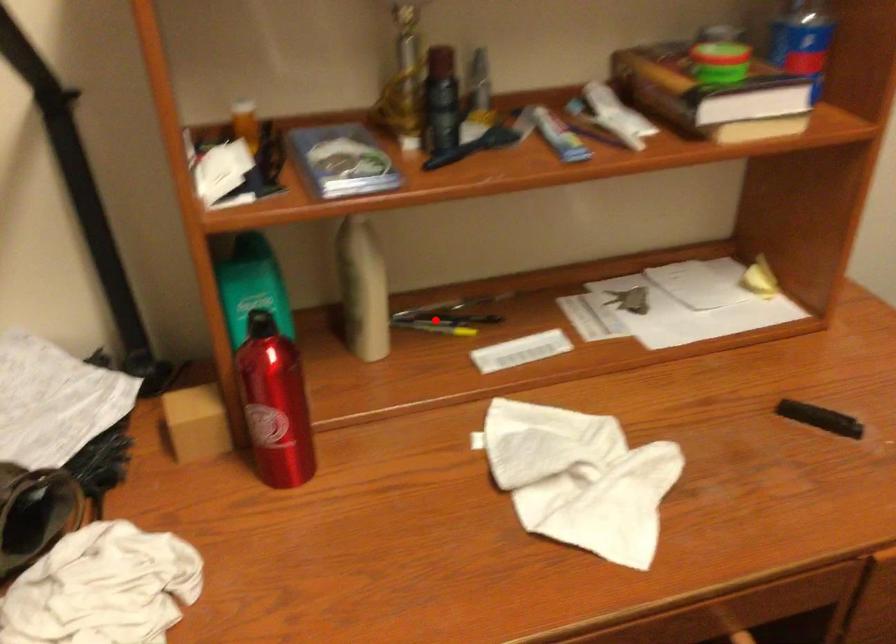
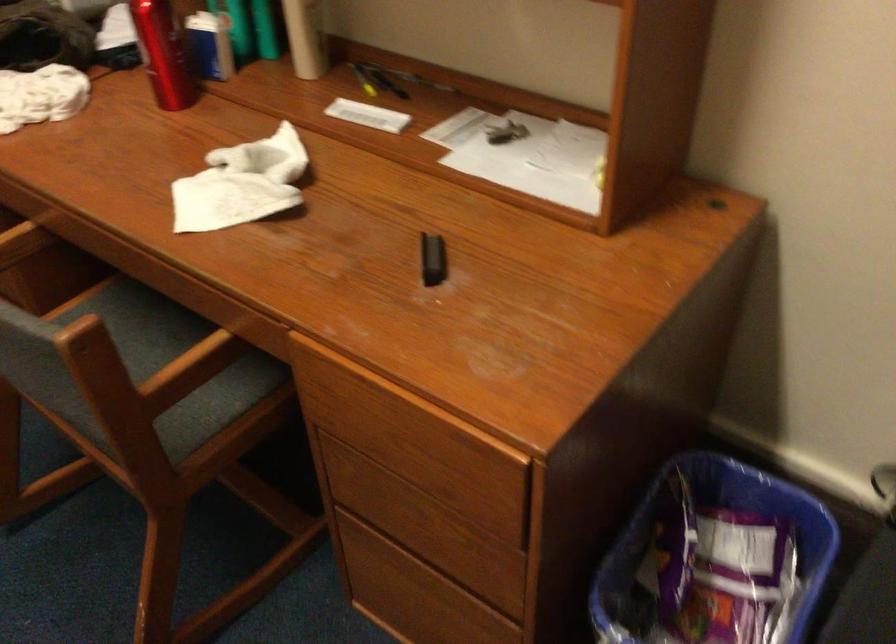
Find the pixel in the second image that matches the highlighted location in the first image.

(376, 80)